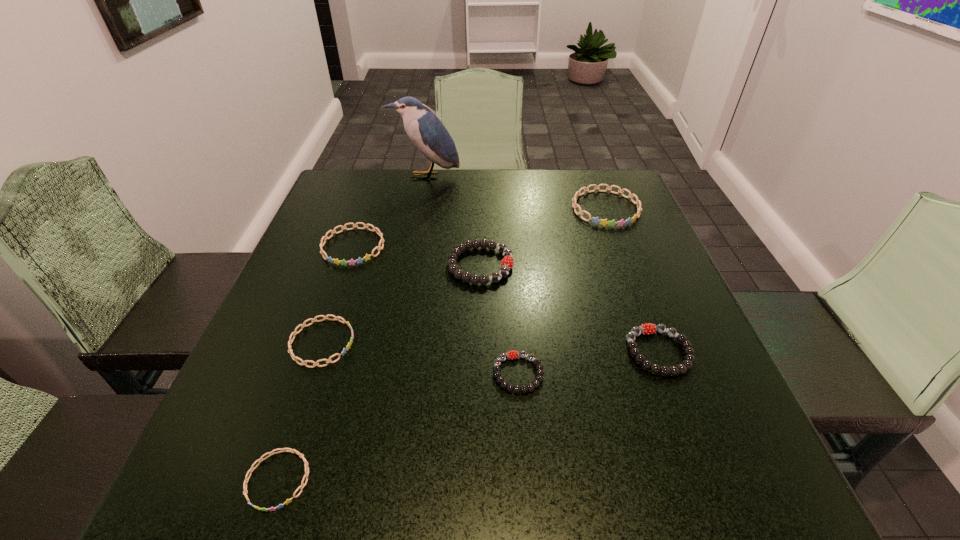
The image size is (960, 540). I want to click on free location located 0.260m at the tip of the farthest object's beak, so click(x=415, y=237).

Where is `free space located 0.100m on the surface of the biggest blue bracelet showing star-shaped elements`? The image size is (960, 540). free space located 0.100m on the surface of the biggest blue bracelet showing star-shaped elements is located at coordinates (623, 253).

In order to click on vacant space situated 0.120m on the back of the farthest black bracelet in this screenshot , I will do `click(480, 217)`.

Identify the location of vacant region located on the surface of the third smallest blue bracelet showing star-shaped elements. (338, 292).

Identify the location of free location located 0.070m on the left of the rightmost black bracelet. This screenshot has height=540, width=960. pyautogui.click(x=589, y=352).

The width and height of the screenshot is (960, 540). Identify the location of blank space located on the surface of the third biggest blue bracelet showing star-shaped elements. (492, 343).

Identify the location of vacant area located 0.170m on the front of the smallest black bracelet. The width and height of the screenshot is (960, 540). (528, 501).

The width and height of the screenshot is (960, 540). In order to click on bird that is positioned at the far edge in this screenshot , I will do [x=426, y=131].

The width and height of the screenshot is (960, 540). Identify the location of bracelet that is at the far edge. (604, 222).

Where is `object at the near edge`? object at the near edge is located at coordinates (272, 452).